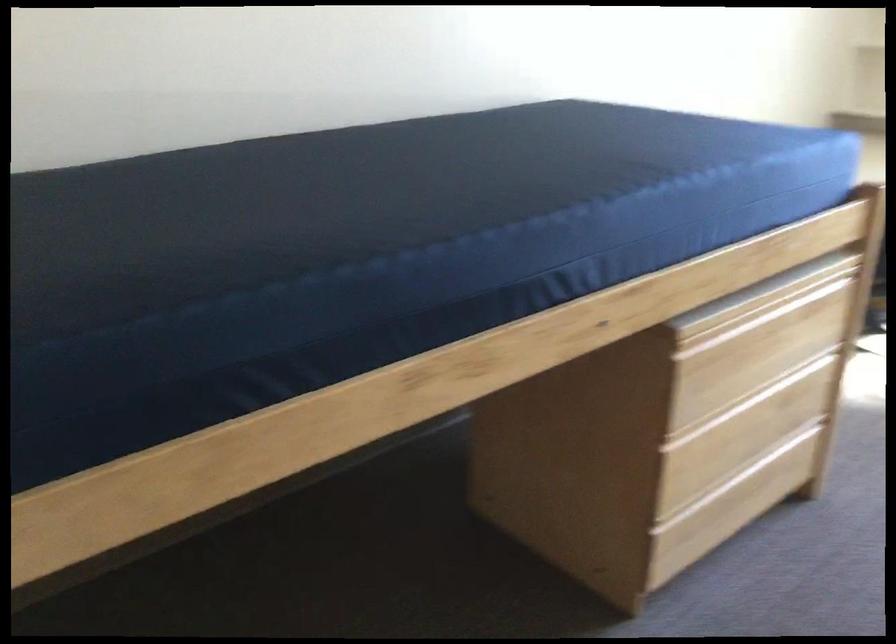
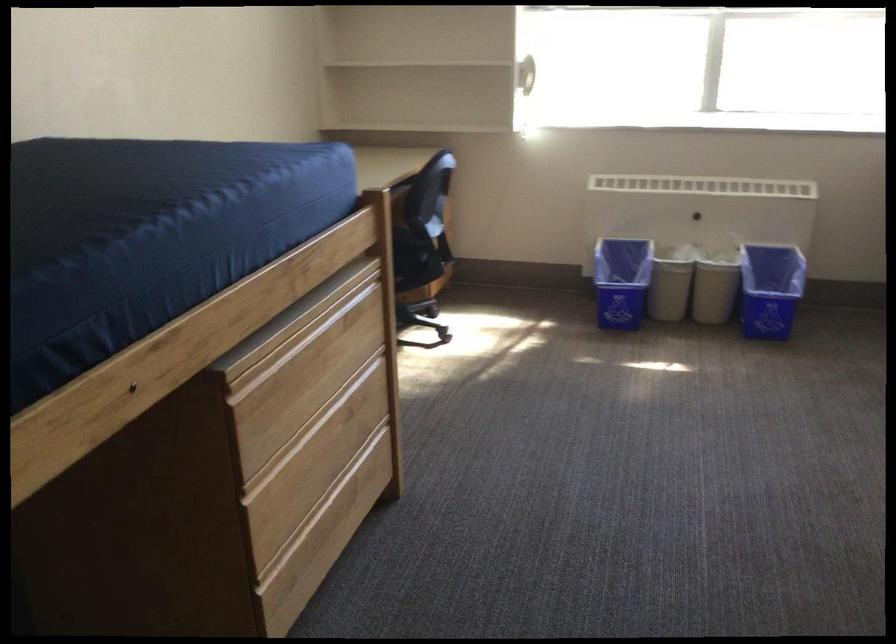
Question: The camera is either moving clockwise (left) or counter-clockwise (right) around the object. The first image is from the beginning of the video and the second image is from the end. Is the camera moving left or right when shooting the video?

Choices:
 (A) Left
 (B) Right

Answer: (A)